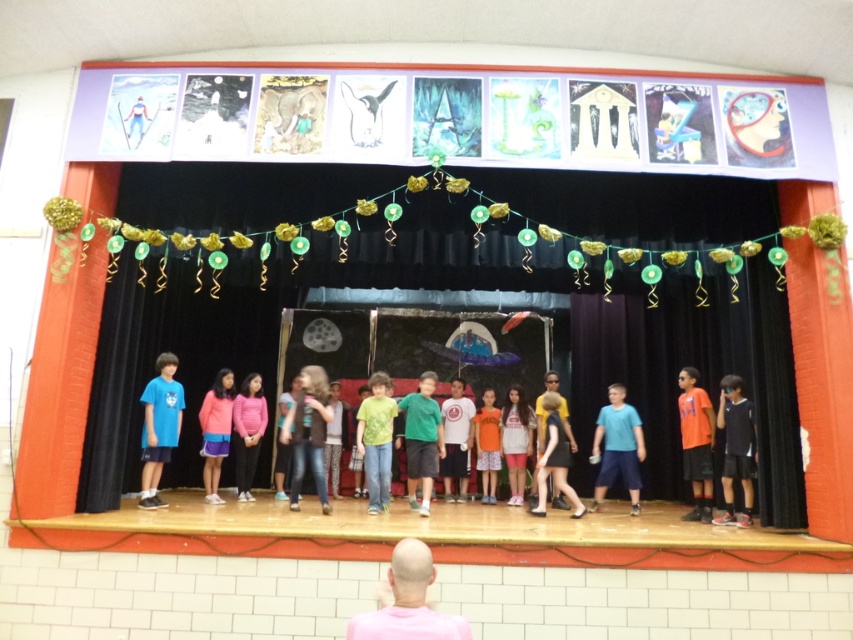
You are standing at the back of the gymnasium watching the school performance. There are two points marked on the stage. The first point is at coordinate point [299,436] and the second is at point [700,392]. Which point is closer to you?

Point [700,392] is further away from you, so point [299,436] is closer to you.

Consider the image. You are a photographer in the audience. You want to take a photo of the orange cotton shirt at right and the orange cotton shirt at center so that both are visible. Which shirt should you focus on to ensure the one behind is also in focus?

You should focus on the orange cotton shirt at center because the orange cotton shirt at right is in front of it, so focusing on the one behind will keep both in focus.

You are a costume designer preparing for a school play. You have two outfits on stage for the main characters. The first is a white cotton shirt at center, and the second is a pink cotton dress at center. Which outfit requires more fabric to make?

The white cotton shirt at center requires more fabric to make since it is bigger than the pink cotton dress at center.